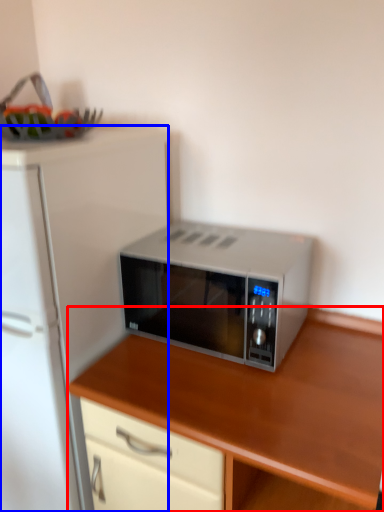
Question: Which of the following is the closest to the observer, cabinetry (highlighted by a red box) or refrigerator (highlighted by a blue box)?

Choices:
 (A) cabinetry
 (B) refrigerator

Answer: (A)